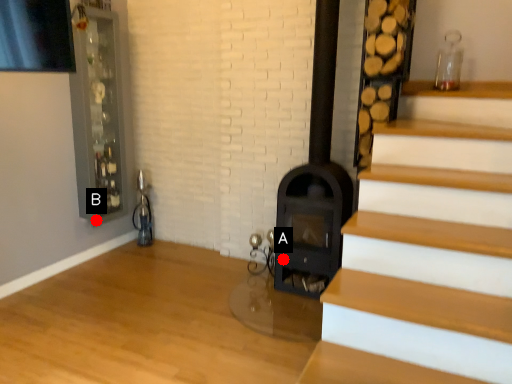
Question: Two points are circled on the image, labeled by A and B beside each circle. Which point is closer to the camera?

Choices:
 (A) A is closer
 (B) B is closer

Answer: (A)